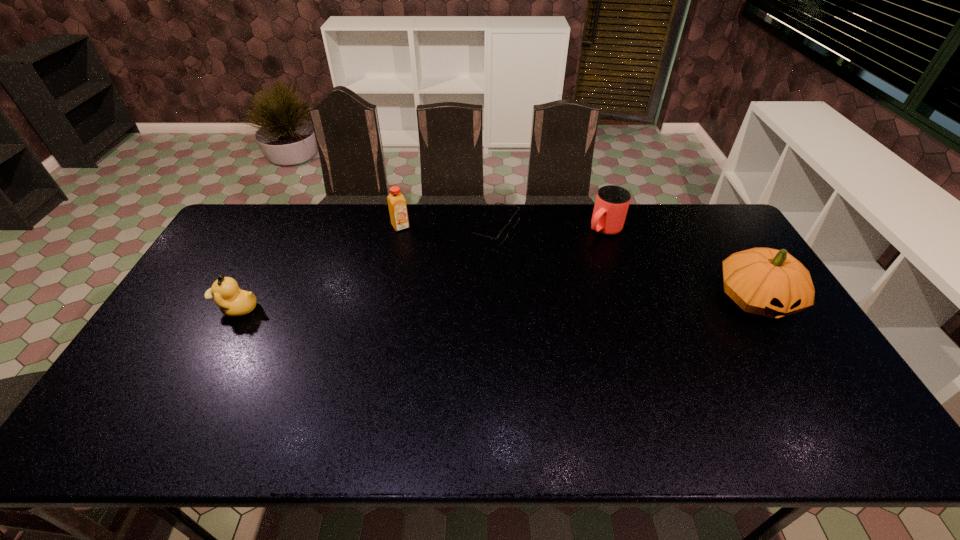
Where is `orange juice that is at the far edge`? The height and width of the screenshot is (540, 960). orange juice that is at the far edge is located at coordinates [x=397, y=205].

The width and height of the screenshot is (960, 540). What are the coordinates of `cup that is at the far edge` in the screenshot? It's located at (612, 202).

Image resolution: width=960 pixels, height=540 pixels. I want to click on object that is positioned at the left edge, so click(x=233, y=302).

Locate an element on the screen. This screenshot has height=540, width=960. object that is positioned at the right edge is located at coordinates (764, 281).

Locate an element on the screen. The width and height of the screenshot is (960, 540). blank space at the far edge of the desktop is located at coordinates (362, 215).

The height and width of the screenshot is (540, 960). What are the coordinates of `vacant space at the near edge of the desktop` in the screenshot? It's located at (415, 402).

You are a GUI agent. You are given a task and a screenshot of the screen. Output one action in this format:
    pyautogui.click(x=<x>, y=<y>)
    Task: Click on the free space at the left edge
    
    Given the screenshot: What is the action you would take?
    pyautogui.click(x=241, y=276)

Where is `vacant space at the far left corner of the desktop`? vacant space at the far left corner of the desktop is located at coordinates (239, 226).

This screenshot has height=540, width=960. What are the coordinates of `free space between the duckling and the fourth object from left to right` in the screenshot? It's located at (420, 269).

Locate an element on the screen. free space between the third object from right to left and the fourth object from left to right is located at coordinates (550, 230).